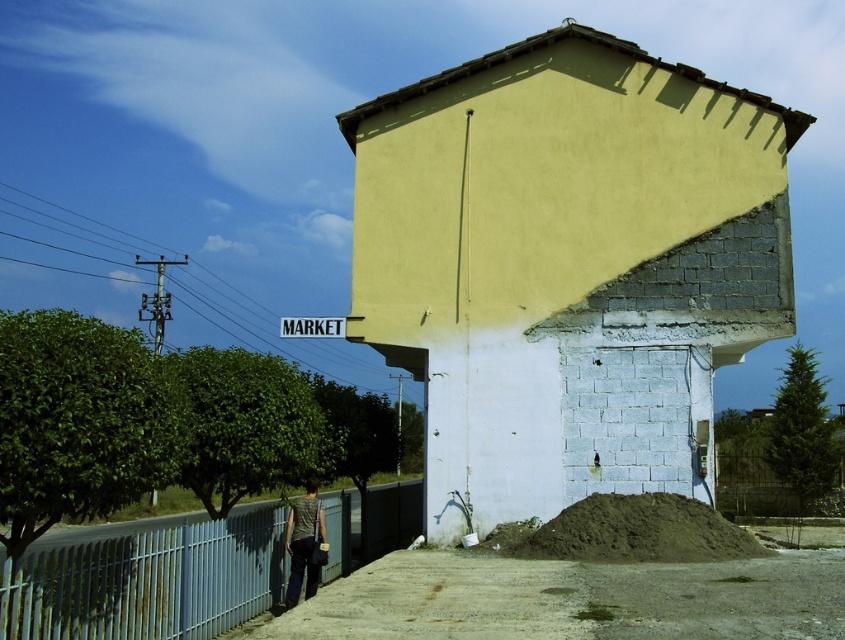
Question: Is the position of blue painted metal fence at lower left more distant than that of green fabric shirt at lower center?

Choices:
 (A) yes
 (B) no

Answer: (B)

Question: Can you confirm if brown dirt at lower right is smaller than green fabric shirt at lower center?

Choices:
 (A) yes
 (B) no

Answer: (B)

Question: Considering the relative positions of blue painted metal fence at lower left and green fabric shirt at lower center in the image provided, where is blue painted metal fence at lower left located with respect to green fabric shirt at lower center?

Choices:
 (A) right
 (B) left

Answer: (B)

Question: Which of the following is the closest to the observer?

Choices:
 (A) brown dirt at lower right
 (B) blue plastic sign at upper center

Answer: (A)

Question: Which object appears farthest from the camera in this image?

Choices:
 (A) brown dirt at lower right
 (B) green fabric shirt at lower center
 (C) blue plastic sign at upper center

Answer: (C)

Question: Which point is closer to the camera?

Choices:
 (A) blue plastic sign at upper center
 (B) green fabric shirt at lower center
 (C) brown dirt at lower right
 (D) blue painted metal fence at lower left

Answer: (D)